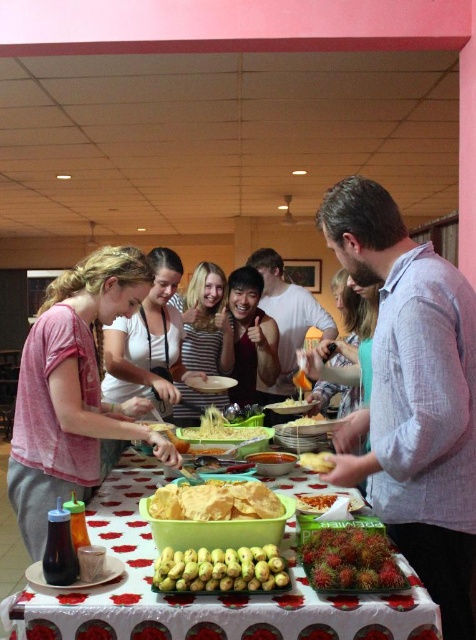
You are a photographer holding a camera. You want to take a photo of the gray cotton shirt at center without moving the shirt. Can you do it from your current position?

The gray cotton shirt at center and camera are 3.77 feet apart from each other, so yes, the photographer can take a photo of the gray cotton shirt at center from their current position as they are within a reasonable distance.

You are at a party and want to grab some chips from the yellow matte chips at center and a condiment from the yellow matte plastic bowl at center. Which direction should you move your hand to reach the bowl after taking the chips?

The yellow matte chips at center is to the left of the yellow matte plastic bowl at center, so you should move your hand to the right to reach the bowl after taking the chips.

You are a guest at this event and want to grab both the yellow matte bananas at center and the yellow matte shredded cheese at center. Which one should you reach for first if you want to pick up the one closer to you?

The yellow matte bananas at center is located below the yellow matte shredded cheese at center, so it is closer to you. You should reach for the yellow matte bananas at center first.